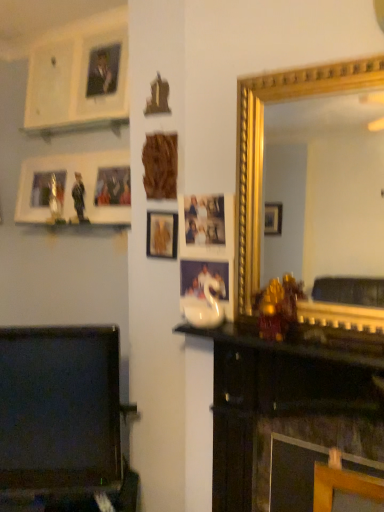
Question: Do you think smooth black tv at lower left is within gold/gilded mirror at center-right, or outside of it?

Choices:
 (A) outside
 (B) inside

Answer: (A)

Question: Is smooth black tv at lower left to the left or to the right of gold/gilded mirror at center-right in the image?

Choices:
 (A) left
 (B) right

Answer: (A)

Question: Which is nearer to the wooden picture frame at center, positioned as the third picture frame in left-to-right order?

Choices:
 (A) smooth black tv at lower left
 (B) wooden carving at center, placed as the 1th picture frame when sorted from front to back
 (C) black glossy mantle at center
 (D) gold/gilded mirror at center-right
 (E) wooden picture frame at upper left, which is the 1th picture frame in left-to-right order

Answer: (B)

Question: Considering the real-world distances, which object is farthest from the wooden carving at center, placed as the 2th picture frame when sorted from left to right?

Choices:
 (A) wooden picture frame at upper left, the third picture frame positioned from the right
 (B) black glossy mantle at center
 (C) wooden picture frame at center, which is the 1th picture frame in right-to-left order
 (D) gold/gilded mirror at center-right
 (E) smooth black tv at lower left

Answer: (D)